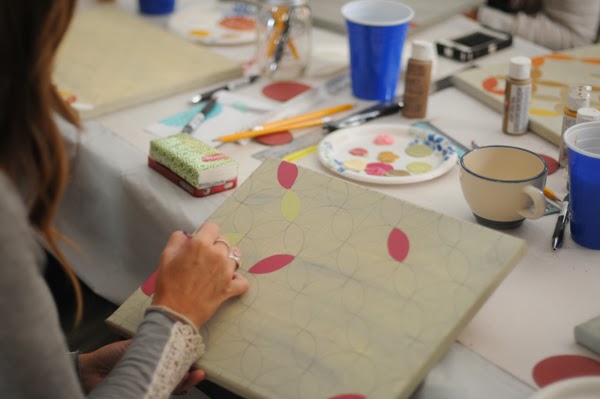
At what (x,y) coordinates should I click in order to perform the action: click on cup. Please return your answer as a coordinate pair (x, y). This screenshot has width=600, height=399. Looking at the image, I should click on (593, 197).